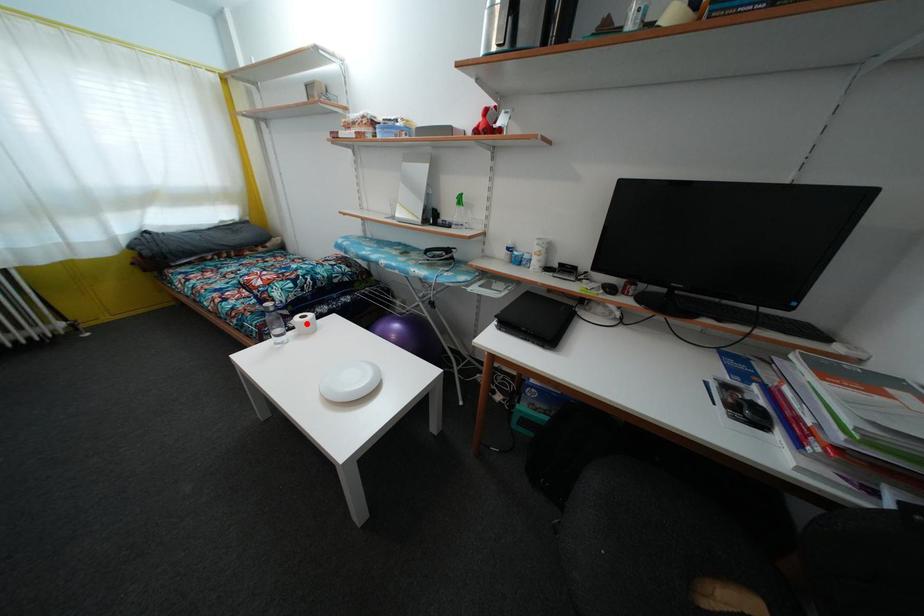
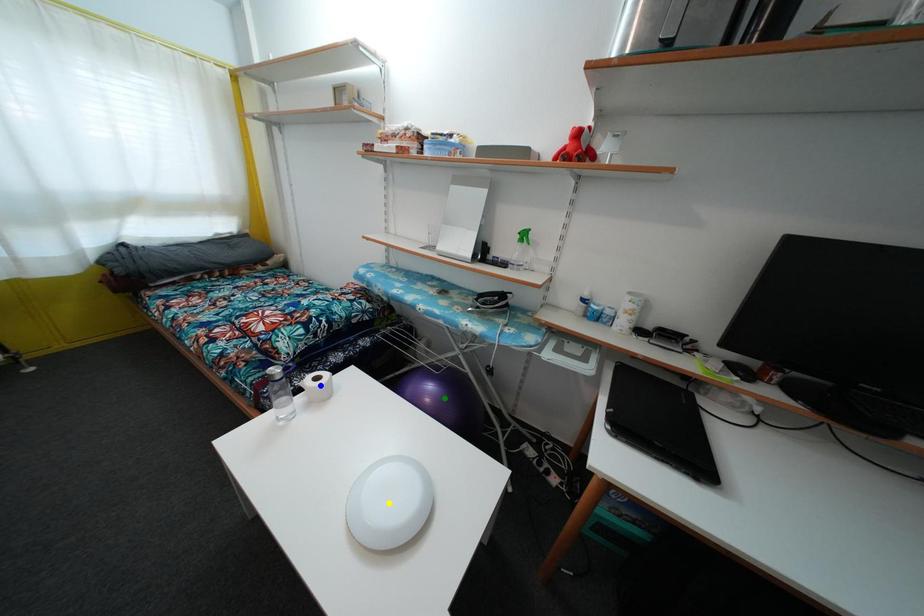
Question: I am providing you with two images of the same scene from different viewpoints. A red point is marked on the first image. You are given multiple points on the second image. Which mark in image 2 goes with the point in image 1?

Choices:
 (A) yellow point
 (B) blue point
 (C) green point

Answer: (B)